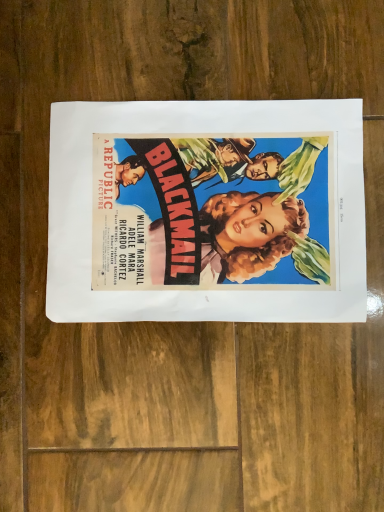
I want to click on vacant region above matte paper poster at center (from a real-world perspective), so click(x=206, y=207).